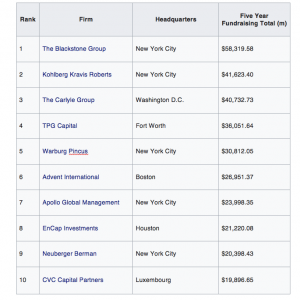
You are a GUI agent. You are given a task and a screenshot of the screen. Output one action in this format:
    pyautogui.click(x=<x>, y=<y>)
    Task: Click on the firm column
    
    Given the screenshot: What is the action you would take?
    pyautogui.click(x=81, y=18)